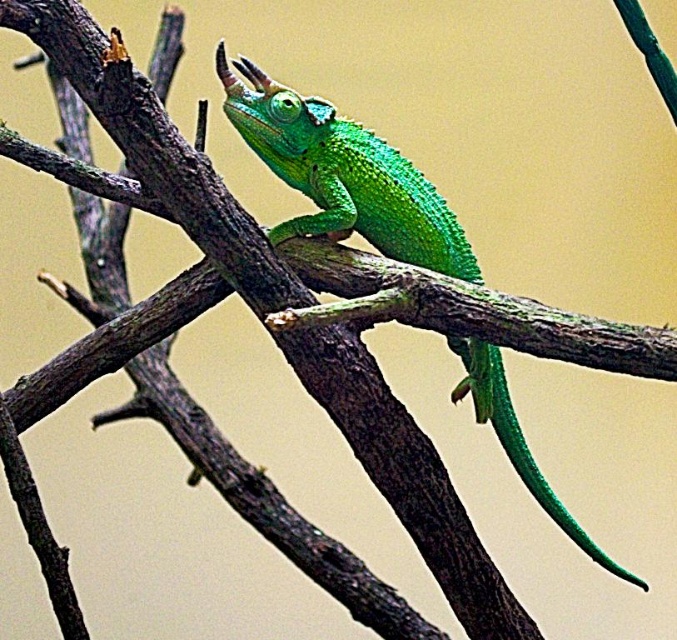
Between green scaly lizard at center and green scaly tail at center, which one has less height?

green scaly tail at center is shorter.

Is green scaly lizard at center further to the viewer compared to green scaly tail at center?

No, it is in front of green scaly tail at center.

Measure the distance between point [324,156] and camera.

Point [324,156] is 1.76 meters from camera.

At what (x,y) coordinates should I click in order to perform the action: click on green scaly lizard at center. Please return your answer as a coordinate pair (x, y). This screenshot has width=677, height=640. Looking at the image, I should click on (343, 176).